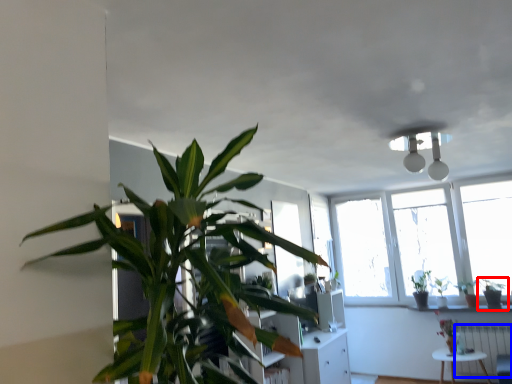
Question: Which of the following is the closest to the observer, houseplant (highlighted by a red box) or radiator (highlighted by a blue box)?

Choices:
 (A) houseplant
 (B) radiator

Answer: (B)